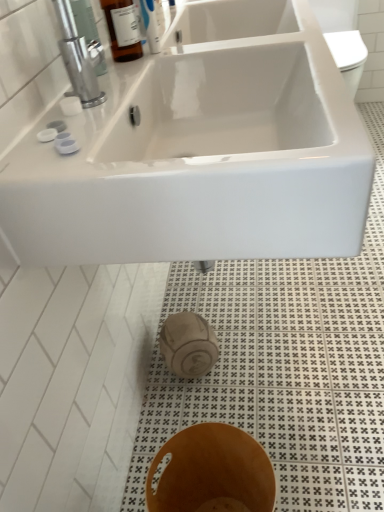
This screenshot has height=512, width=384. What do you see at coordinates (212, 472) in the screenshot? I see `brown wood bidet at lower center` at bounding box center [212, 472].

In order to face metallic silver faucet at upper left, should I rotate leftwards or rightwards?

To align with it, rotate left about 13.640°.

The image size is (384, 512). Find the location of `white glossy sink at upper center`. white glossy sink at upper center is located at coordinates (202, 163).

The width and height of the screenshot is (384, 512). In order to click on brown wood bidet at lower center in this screenshot , I will do `click(212, 472)`.

Is point (70, 7) more distant than point (279, 215)?

Yes, it is.

Which of these two, metallic silver faucet at upper left or white glossy sink at upper center, is wider?

white glossy sink at upper center is wider.

Does metallic silver faucet at upper left lie in front of white glossy sink at upper center?

No, metallic silver faucet at upper left is further to the viewer.

Considering the sizes of objects metallic silver faucet at upper left and white glossy sink at upper center in the image provided, who is taller, metallic silver faucet at upper left or white glossy sink at upper center?

Standing taller between the two is white glossy sink at upper center.

Does point (247, 452) come behind point (77, 44)?

Yes, point (247, 452) is behind point (77, 44).

Find the location of a particular element. bidet lying on the right of metallic silver faucet at upper left is located at coordinates (212, 472).

How far apart are brown wood bidet at lower center and metallic silver faucet at upper left?

They are 29.65 inches apart.

Who is bigger, brown wood bidet at lower center or metallic silver faucet at upper left?

brown wood bidet at lower center.

Which of these two, white glossy sink at upper center or brown wood bidet at lower center, is bigger?

white glossy sink at upper center is bigger.

Would you say white glossy sink at upper center is a long distance from brown wood bidet at lower center?

No, white glossy sink at upper center is in close proximity to brown wood bidet at lower center.

Considering the positions of objects white glossy sink at upper center and brown wood bidet at lower center in the image provided, who is in front, white glossy sink at upper center or brown wood bidet at lower center?

Positioned in front is white glossy sink at upper center.

From a real-world perspective, which object rests below the other?

brown wood bidet at lower center, from a real-world perspective.

Which object is further away from the camera, metallic silver faucet at upper left or brown wood bidet at lower center?

metallic silver faucet at upper left is further away from the camera.

Is point (62, 18) positioned behind point (263, 478)?

No, it is in front of (263, 478).

Can you confirm if metallic silver faucet at upper left is positioned to the right of brown wood bidet at lower center?

No, metallic silver faucet at upper left is not to the right of brown wood bidet at lower center.

Is white glossy sink at upper center with metallic silver faucet at upper left?

white glossy sink at upper center and metallic silver faucet at upper left are clearly separated.

Considering the relative sizes of white glossy sink at upper center and metallic silver faucet at upper left in the image provided, is white glossy sink at upper center bigger than metallic silver faucet at upper left?

Correct, white glossy sink at upper center is larger in size than metallic silver faucet at upper left.

Is white glossy sink at upper center taller than metallic silver faucet at upper left?

Yes, white glossy sink at upper center is taller than metallic silver faucet at upper left.

What's the angular difference between white glossy sink at upper center and metallic silver faucet at upper left's facing directions?

There is a 0.187-degree angle between the facing directions of white glossy sink at upper center and metallic silver faucet at upper left.

Is brown wood bidet at lower center at the right side of white glossy sink at upper center?

Incorrect, brown wood bidet at lower center is not on the right side of white glossy sink at upper center.

Is brown wood bidet at lower center far from white glossy sink at upper center?

brown wood bidet at lower center is near white glossy sink at upper center, not far away.

What's the angular difference between brown wood bidet at lower center and white glossy sink at upper center's facing directions?

The facing directions of brown wood bidet at lower center and white glossy sink at upper center are 0.000535 degrees apart.

From the image's perspective, which is above, brown wood bidet at lower center or white glossy sink at upper center?

white glossy sink at upper center, from the image's perspective.

In the image, there is a metallic silver faucet at upper left. At what (x,y) coordinates should I click in order to perform the action: click on sink below it (from a real-world perspective). Please return your answer as a coordinate pair (x, y). Image resolution: width=384 pixels, height=512 pixels. Looking at the image, I should click on (202, 163).

At what (x,y) coordinates should I click in order to perform the action: click on tap located above the brown wood bidet at lower center (from the image's perspective). Please return your answer as a coordinate pair (x, y). The image size is (384, 512). Looking at the image, I should click on (79, 57).

When comparing their distances from white glossy sink at upper center, does metallic silver faucet at upper left or brown wood bidet at lower center seem further?

brown wood bidet at lower center is positioned further to the anchor white glossy sink at upper center.

Which object lies further to the anchor point metallic silver faucet at upper left, brown wood bidet at lower center or white glossy sink at upper center?

brown wood bidet at lower center.

Considering their positions, is white glossy sink at upper center positioned further to metallic silver faucet at upper left than brown wood bidet at lower center?

brown wood bidet at lower center is positioned further to the anchor metallic silver faucet at upper left.

From the picture: Based on their spatial positions, is metallic silver faucet at upper left or white glossy sink at upper center closer to brown wood bidet at lower center?

white glossy sink at upper center lies closer to brown wood bidet at lower center than the other object.

Considering their positions, is white glossy sink at upper center positioned closer to brown wood bidet at lower center than metallic silver faucet at upper left?

white glossy sink at upper center lies closer to brown wood bidet at lower center than the other object.

Which object lies further to the anchor point white glossy sink at upper center, brown wood bidet at lower center or metallic silver faucet at upper left?

Based on the image, brown wood bidet at lower center appears to be further to white glossy sink at upper center.

The height and width of the screenshot is (512, 384). I want to click on sink that lies between metallic silver faucet at upper left and brown wood bidet at lower center from top to bottom, so click(202, 163).